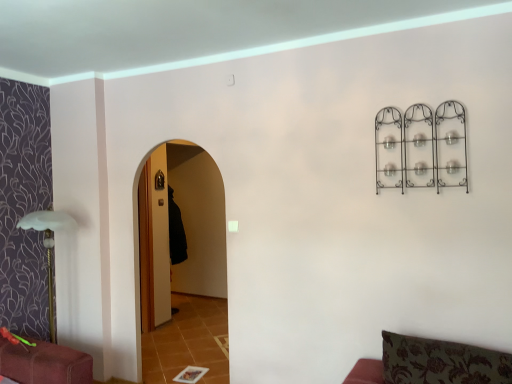
Where is `green floral fabric cushion at lower right`? Image resolution: width=512 pixels, height=384 pixels. green floral fabric cushion at lower right is located at coordinates (432, 363).

This screenshot has width=512, height=384. What do you see at coordinates (432, 363) in the screenshot?
I see `green floral fabric cushion at lower right` at bounding box center [432, 363].

Describe the element at coordinates (176, 231) in the screenshot. I see `black fabric robe at center` at that location.

Where is `black fabric robe at center`? The height and width of the screenshot is (384, 512). black fabric robe at center is located at coordinates (176, 231).

You are a GUI agent. You are given a task and a screenshot of the screen. Output one action in this format:
    pyautogui.click(x=<x>, y=<y>)
    Task: Click on the green floral fabric cushion at lower right
    
    Given the screenshot: What is the action you would take?
    pyautogui.click(x=432, y=363)

Is green floral fabric cushion at lower right to the right of black fabric robe at center from the viewer's perspective?

Indeed, green floral fabric cushion at lower right is positioned on the right side of black fabric robe at center.

Which is in front, green floral fabric cushion at lower right or black fabric robe at center?

green floral fabric cushion at lower right is more forward.

Is point (460, 360) closer or farther from the camera than point (183, 256)?

Point (460, 360) appears to be closer to the viewer than point (183, 256).

From the image's perspective, which object appears higher, green floral fabric cushion at lower right or black fabric robe at center?

black fabric robe at center appears higher in the image.

From a real-world perspective, is green floral fabric cushion at lower right located beneath black fabric robe at center?

Yes.

Which object is thinner, green floral fabric cushion at lower right or black fabric robe at center?

Thinner between the two is black fabric robe at center.

Between green floral fabric cushion at lower right and black fabric robe at center, which one has less height?

green floral fabric cushion at lower right.

Considering the relative sizes of green floral fabric cushion at lower right and black fabric robe at center in the image provided, is green floral fabric cushion at lower right smaller than black fabric robe at center?

No, green floral fabric cushion at lower right is not smaller than black fabric robe at center.

Is green floral fabric cushion at lower right outside of black fabric robe at center?

Indeed, green floral fabric cushion at lower right is completely outside black fabric robe at center.

Is green floral fabric cushion at lower right placed right next to black fabric robe at center?

green floral fabric cushion at lower right and black fabric robe at center are not in contact.

Is green floral fabric cushion at lower right positioned with its back to black fabric robe at center?

No, green floral fabric cushion at lower right's orientation is not away from black fabric robe at center.

At what (x,y) coordinates should I click in order to perform the action: click on robe lying above the green floral fabric cushion at lower right (from the image's perspective). Please return your answer as a coordinate pair (x, y). Looking at the image, I should click on (176, 231).

Visually, is black fabric robe at center positioned to the left or to the right of green floral fabric cushion at lower right?

In the image, black fabric robe at center appears on the left side of green floral fabric cushion at lower right.

In the image, is black fabric robe at center positioned in front of or behind green floral fabric cushion at lower right?

black fabric robe at center is behind green floral fabric cushion at lower right.

Which is further, (181, 217) or (418, 346)?

The point (181, 217) is behind.

In the scene shown: From the image's perspective, is black fabric robe at center positioned above or below green floral fabric cushion at lower right?

black fabric robe at center is above green floral fabric cushion at lower right.

From a real-world perspective, which object stands above the other?

black fabric robe at center is physically above.

Which object is wider, black fabric robe at center or green floral fabric cushion at lower right?

green floral fabric cushion at lower right is wider.

Is black fabric robe at center shorter than green floral fabric cushion at lower right?

No.

Does black fabric robe at center have a larger size compared to green floral fabric cushion at lower right?

Incorrect, black fabric robe at center is not larger than green floral fabric cushion at lower right.

Is green floral fabric cushion at lower right a part of black fabric robe at center?

That's incorrect, green floral fabric cushion at lower right is not inside black fabric robe at center.

Is black fabric robe at center with green floral fabric cushion at lower right?

black fabric robe at center and green floral fabric cushion at lower right are not in contact.

Is black fabric robe at center turned away from green floral fabric cushion at lower right?

That's not correct — black fabric robe at center is not looking away from green floral fabric cushion at lower right.

What are the coordinates of `furniture that is in front of the black fabric robe at center` in the screenshot? It's located at (432, 363).

This screenshot has width=512, height=384. Identify the location of robe above the green floral fabric cushion at lower right (from a real-world perspective). (176, 231).

I want to click on furniture in front of the black fabric robe at center, so click(x=432, y=363).